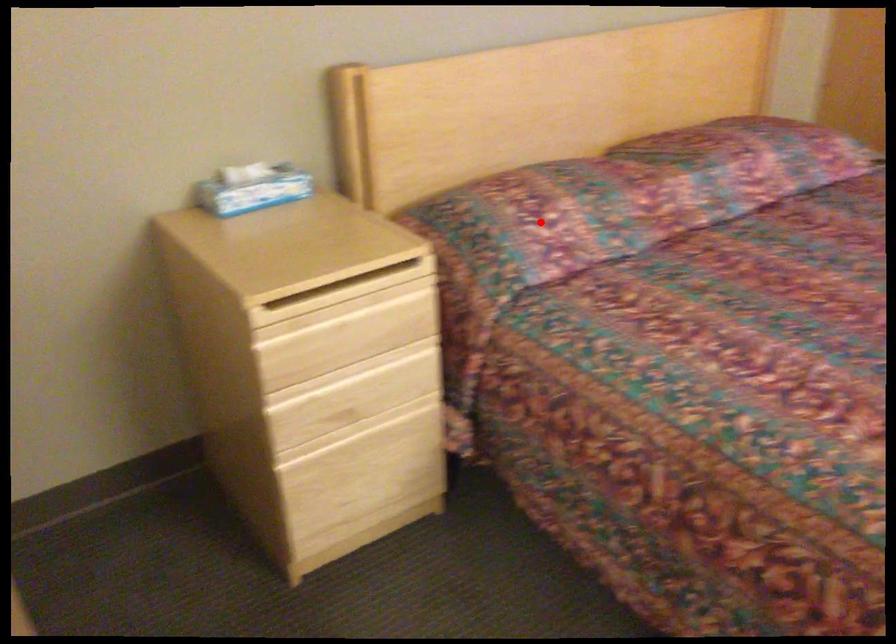
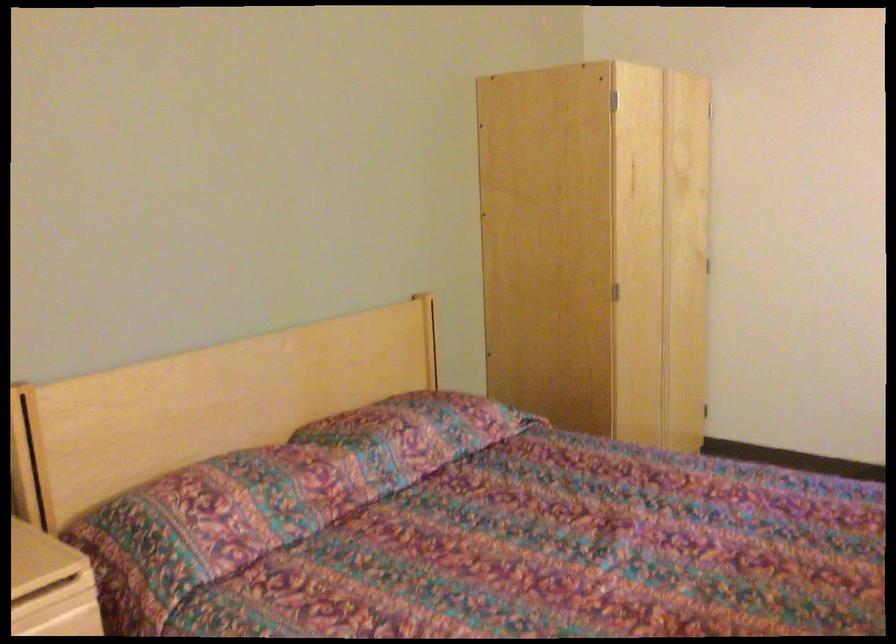
Where in the second image is the point corresponding to the highlighted location from the first image?

(211, 518)